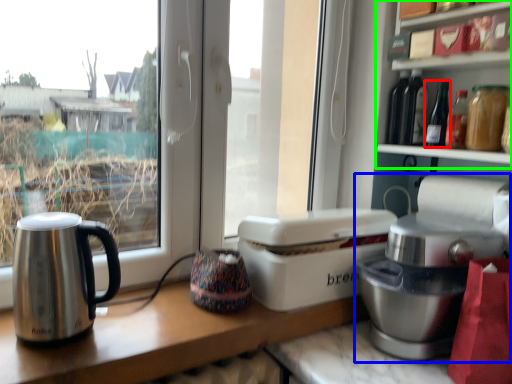
Question: Estimate the real-world distances between objects in this image. Which object is closer to bottle (highlighted by a red box), home appliance (highlighted by a blue box) or shelf (highlighted by a green box)?

Choices:
 (A) home appliance
 (B) shelf

Answer: (B)